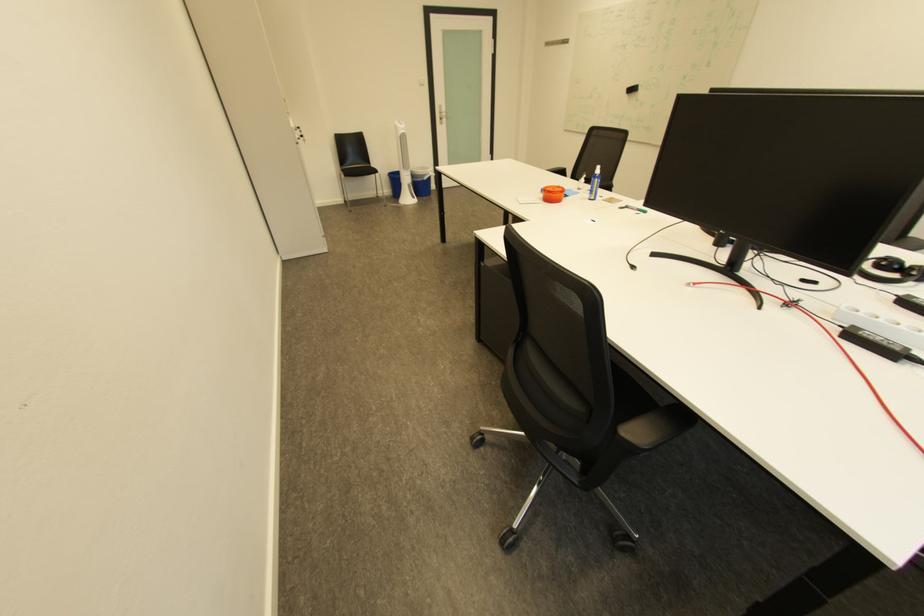
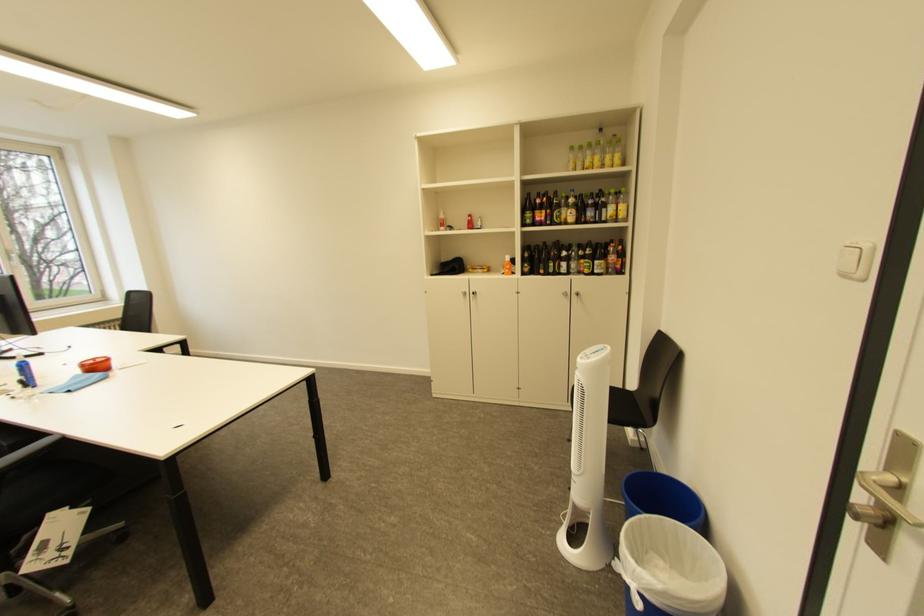
Find the pixel in the second image that matches [439,175] in the first image.

(636, 570)